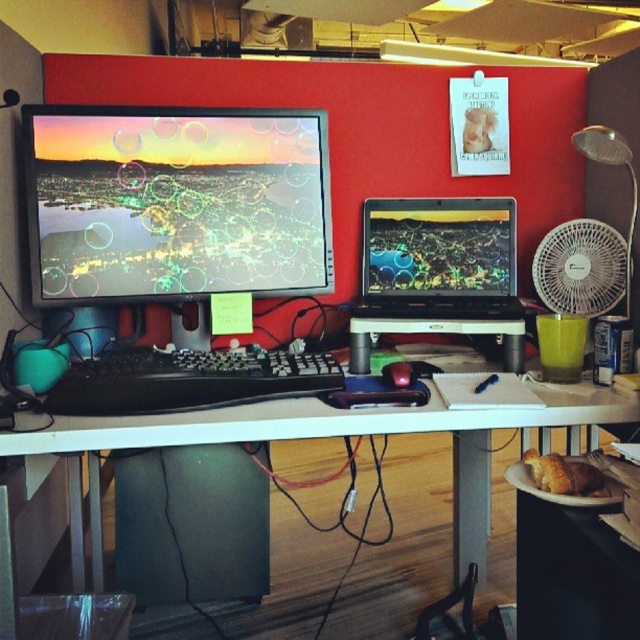
Between point (582, 305) and point (387, 364), which one is positioned in front?

Point (387, 364) is more forward.

Find the location of a particular element. This screenshot has width=640, height=640. white plastic fan at right is located at coordinates (580, 268).

Which is more to the right, black matte keyboard at center or white plastic fan at right?

white plastic fan at right

Which of these two, black matte keyboard at center or white plastic fan at right, stands shorter?

black matte keyboard at center is shorter.

Between point (125, 387) and point (611, 275), which one is positioned in front?

Point (125, 387)

Locate an element on the screen. black matte keyboard at center is located at coordinates (188, 380).

Does matte black monitor at center come in front of white plastic fan at right?

Yes.

Between matte black monitor at center and white plastic fan at right, which one has more height?

matte black monitor at center is taller.

Find the location of `matte black monitor at center`. matte black monitor at center is located at coordinates (176, 202).